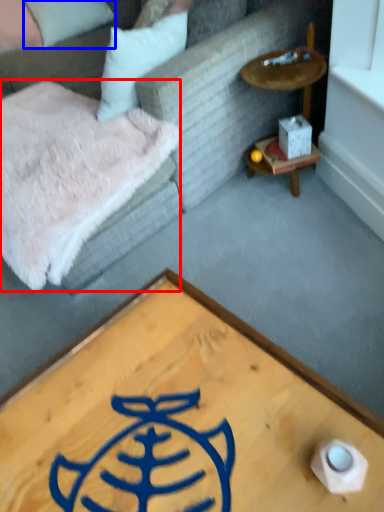
Question: Which point is further to the camera, blanket (highlighted by a red box) or pillow (highlighted by a blue box)?

Choices:
 (A) blanket
 (B) pillow

Answer: (B)